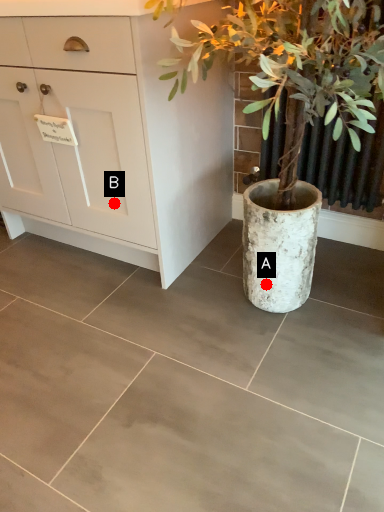
Question: Two points are circled on the image, labeled by A and B beside each circle. Among these points, which one is nearest to the camera?

Choices:
 (A) A is closer
 (B) B is closer

Answer: (A)